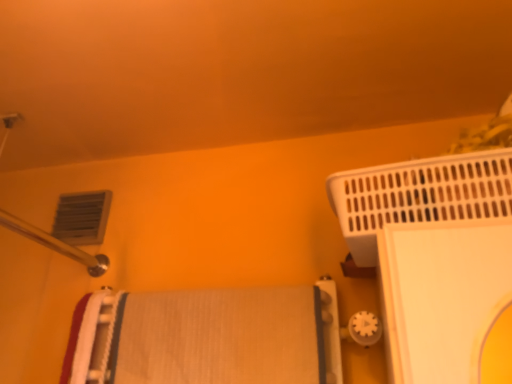
Question: From a real-world perspective, is white textured bath towel at center physically below white plastic bath heater at upper right?

Choices:
 (A) no
 (B) yes

Answer: (B)

Question: Is white plastic bath heater at upper right at the back of white textured bath towel at center?

Choices:
 (A) yes
 (B) no

Answer: (B)

Question: Can you confirm if white textured bath towel at center is positioned to the left of white plastic bath heater at upper right?

Choices:
 (A) no
 (B) yes

Answer: (B)

Question: Does white textured bath towel at center contain white plastic bath heater at upper right?

Choices:
 (A) yes
 (B) no

Answer: (B)

Question: Does white textured bath towel at center come behind white plastic bath heater at upper right?

Choices:
 (A) no
 (B) yes

Answer: (B)

Question: Would you say matte plastic air conditioning at upper left is to the left or to the right of white plastic bath heater at upper right in the picture?

Choices:
 (A) right
 (B) left

Answer: (B)

Question: Looking at the image, does matte plastic air conditioning at upper left seem bigger or smaller compared to white plastic bath heater at upper right?

Choices:
 (A) small
 (B) big

Answer: (A)

Question: From a real-world perspective, is matte plastic air conditioning at upper left physically located above or below white plastic bath heater at upper right?

Choices:
 (A) above
 (B) below

Answer: (A)

Question: Is matte plastic air conditioning at upper left in front of or behind white plastic bath heater at upper right in the image?

Choices:
 (A) front
 (B) behind

Answer: (B)

Question: Which is correct: white plastic bath heater at upper right is inside white textured bath towel at center, or outside of it?

Choices:
 (A) outside
 (B) inside

Answer: (A)

Question: From the image's perspective, is white plastic bath heater at upper right positioned above or below white textured bath towel at center?

Choices:
 (A) below
 (B) above

Answer: (B)

Question: Does point (349, 203) appear closer or farther from the camera than point (285, 380)?

Choices:
 (A) farther
 (B) closer

Answer: (A)

Question: In terms of width, does white plastic bath heater at upper right look wider or thinner when compared to white textured bath towel at center?

Choices:
 (A) wide
 (B) thin

Answer: (A)

Question: From a real-world perspective, is matte plastic air conditioning at upper left positioned above or below white textured bath towel at center?

Choices:
 (A) above
 (B) below

Answer: (A)

Question: Considering the positions of matte plastic air conditioning at upper left and white textured bath towel at center in the image, is matte plastic air conditioning at upper left taller or shorter than white textured bath towel at center?

Choices:
 (A) short
 (B) tall

Answer: (A)